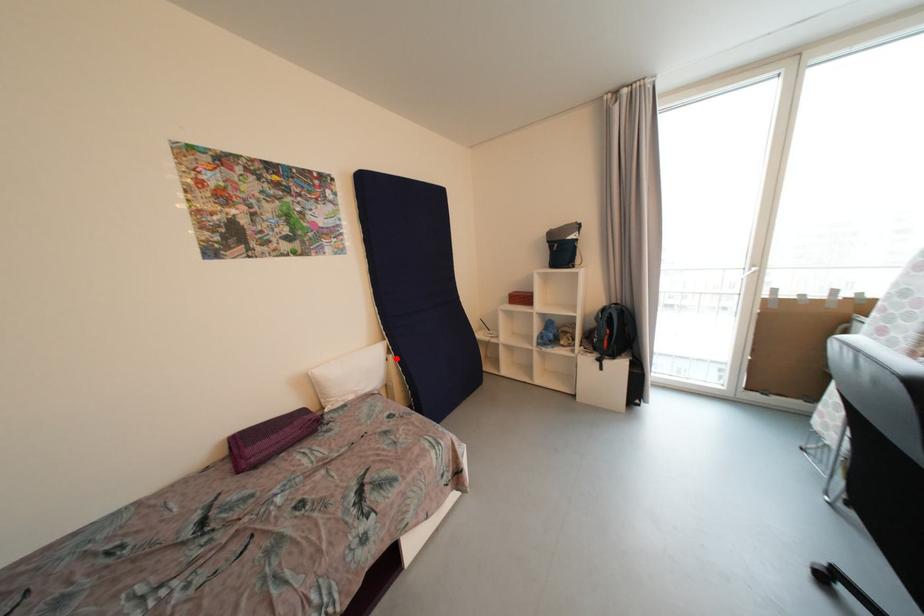
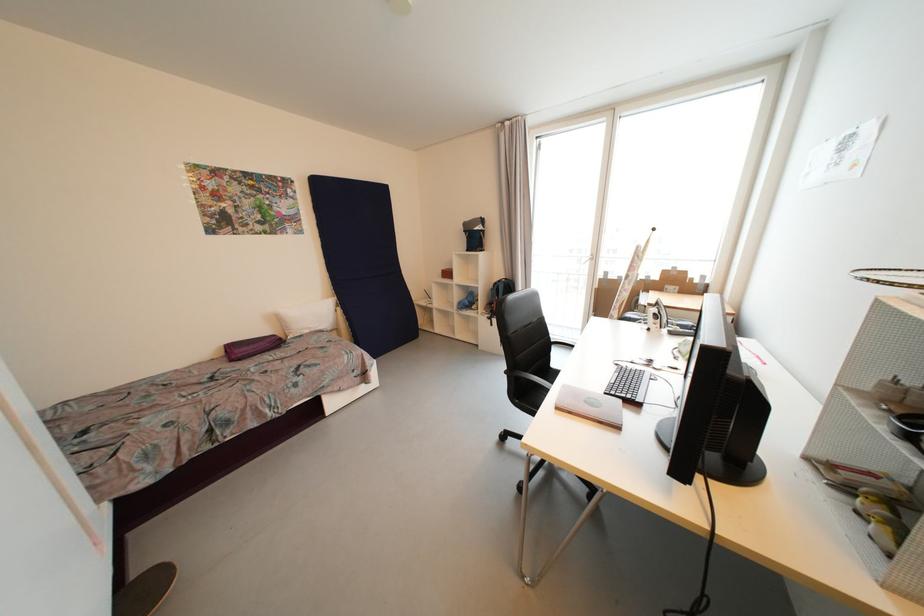
Question: I am providing you with two images of the same scene from different viewpoints. Image1 has a red point marked. In image2, the corresponding 3D location appears at what relative position? Reply with the corresponding letter.

Choices:
 (A) Closer
 (B) Farther

Answer: (B)